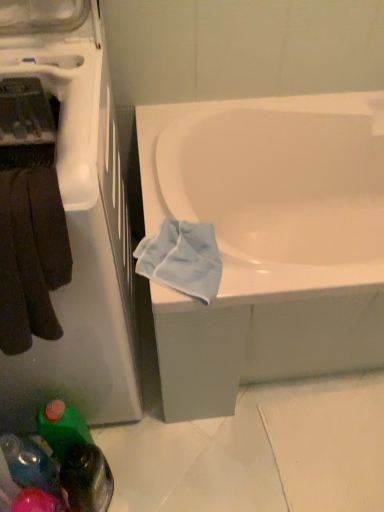
Question: Looking at their shapes, would you say light blue fabric at lower right is wider or thinner than white glossy bathtub at center?

Choices:
 (A) thin
 (B) wide

Answer: (A)

Question: Would you say light blue fabric at lower right is inside or outside white glossy bathtub at center?

Choices:
 (A) outside
 (B) inside

Answer: (B)

Question: Which object is positioned farthest from the light blue fabric at lower right?

Choices:
 (A) green plastic bottle at lower left, which appears as the second bottle when viewed from the left
 (B) white glossy dishwasher at left
 (C) translucent plastic bottle at lower left, marked as the 1th bottle in a left-to-right arrangement
 (D) white glossy bathtub at center
 (E) dark brown towel at left

Answer: (C)

Question: Estimate the real-world distances between objects in this image. Which object is farther from the white glossy bathtub at center?

Choices:
 (A) translucent plastic bottle at lower left, placed as the 2th bottle when sorted from right to left
 (B) dark brown towel at left
 (C) light blue fabric at lower right
 (D) green plastic bottle at lower left, marked as the 1th bottle in a right-to-left arrangement
 (E) white glossy dishwasher at left

Answer: (A)